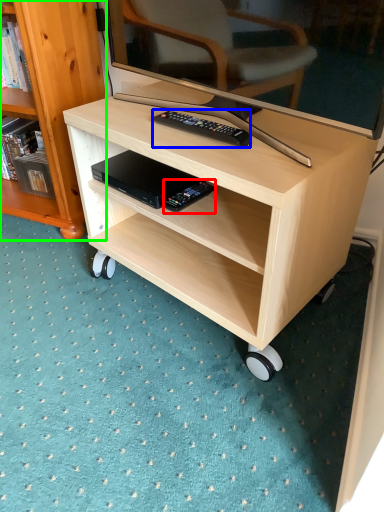
Question: Which object is the farthest from equipment (highlighted by a red box)? Choose among these: remote control (highlighted by a blue box) or bookcase (highlighted by a green box).

Choices:
 (A) remote control
 (B) bookcase

Answer: (B)